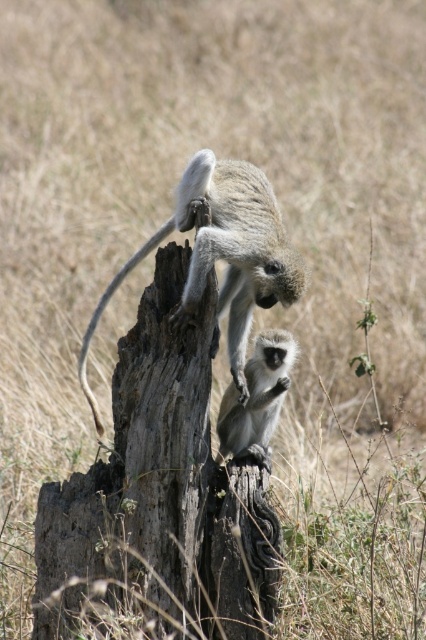
Question: Which of the following is the farthest from the observer?

Choices:
 (A) (158, 609)
 (B) (258, 339)
 (C) (233, 358)

Answer: (C)

Question: Which is nearer to the gray rough tree trunk at center?

Choices:
 (A) gray furry monkey at center
 (B) gray-green fur monkey at center

Answer: (A)

Question: Is gray rough tree trunk at center further to the viewer compared to gray furry monkey at center?

Choices:
 (A) no
 (B) yes

Answer: (A)

Question: Which point appears farthest from the camera in this image?

Choices:
 (A) (267, 250)
 (B) (189, 595)
 (C) (270, 358)

Answer: (C)

Question: Is the position of gray furry monkey at center more distant than that of gray-green fur monkey at center?

Choices:
 (A) yes
 (B) no

Answer: (B)

Question: Is gray rough tree trunk at center behind gray-green fur monkey at center?

Choices:
 (A) no
 (B) yes

Answer: (A)